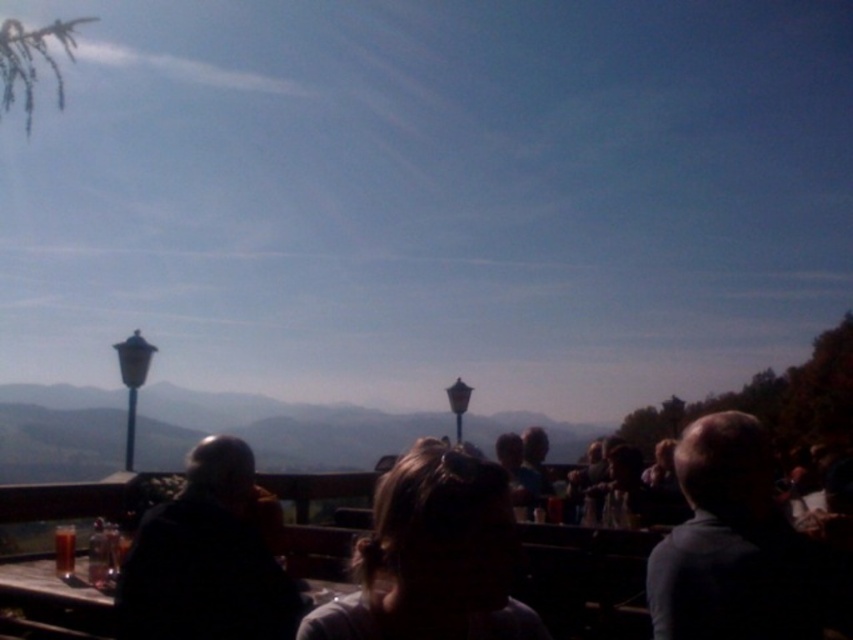
Question: Does dark brown leather jacket at center appear on the right side of wooden table at lower left?

Choices:
 (A) yes
 (B) no

Answer: (A)

Question: Where is dark gray hair at right located in relation to dark brown leather jacket at center in the image?

Choices:
 (A) below
 (B) above

Answer: (B)

Question: Which object is positioned farthest from the light brown hair at center?

Choices:
 (A) wooden table at lower left
 (B) dark brown leather jacket at center

Answer: (A)

Question: Does light brown hair at center have a smaller size compared to dark brown leather jacket at center?

Choices:
 (A) yes
 (B) no

Answer: (A)

Question: Which of the following is the closest to the observer?

Choices:
 (A) (434, 564)
 (B) (689, 490)

Answer: (A)

Question: Which object is closer to the camera taking this photo?

Choices:
 (A) wooden table at lower left
 (B) light brown hair at center

Answer: (B)